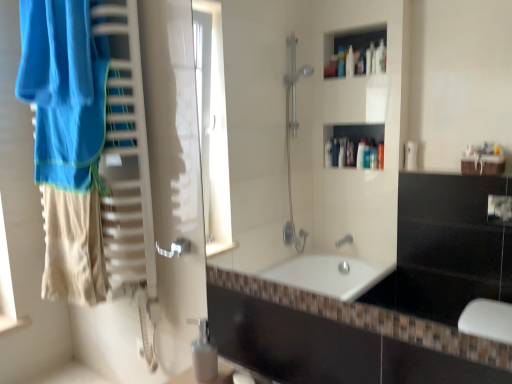
Image resolution: width=512 pixels, height=384 pixels. What do you see at coordinates (203, 353) in the screenshot?
I see `white glossy soap dispenser at lower center` at bounding box center [203, 353].

At what (x,y) coordinates should I click in order to perform the action: click on white glossy soap dispenser at lower center. Please return your answer as a coordinate pair (x, y). The height and width of the screenshot is (384, 512). Looking at the image, I should click on (203, 353).

From the picture: In order to face white glossy soap dispenser at lower center, should I rotate leftwards or rightwards?

You should look left and rotate roughly 6.616 degrees.

Where is `white glossy soap dispenser at lower center`? white glossy soap dispenser at lower center is located at coordinates (203, 353).